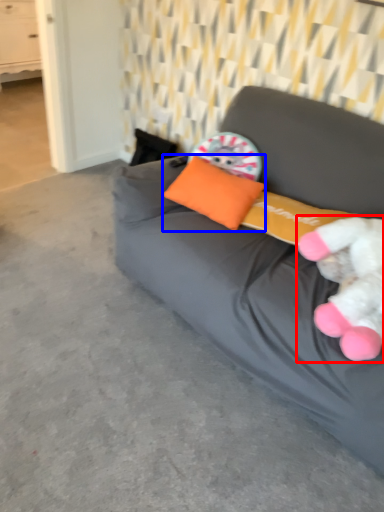
Question: Which object is further to the camera taking this photo, toy (highlighted by a red box) or pillow (highlighted by a blue box)?

Choices:
 (A) toy
 (B) pillow

Answer: (B)